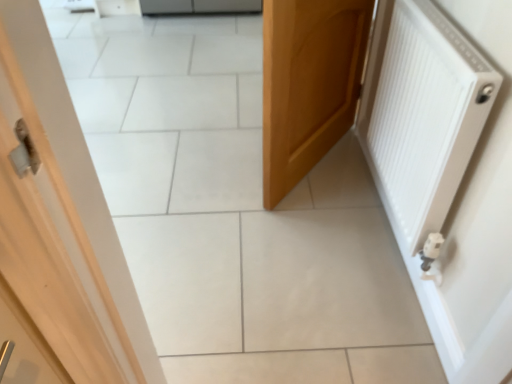
Question: From their relative heights in the image, would you say white matte radiator at right is taller or shorter than wooden door at center?

Choices:
 (A) tall
 (B) short

Answer: (B)

Question: Looking at their shapes, would you say white matte radiator at right is wider or thinner than wooden door at center?

Choices:
 (A) wide
 (B) thin

Answer: (B)

Question: From the image's perspective, is white matte radiator at right above or below wooden door at center?

Choices:
 (A) below
 (B) above

Answer: (A)

Question: From a real-world perspective, relative to white matte radiator at right, is wooden door at center vertically above or below?

Choices:
 (A) below
 (B) above

Answer: (A)

Question: Considering the positions of wooden door at center and white matte radiator at right in the image, is wooden door at center taller or shorter than white matte radiator at right?

Choices:
 (A) tall
 (B) short

Answer: (A)

Question: Would you say wooden door at center is to the left or to the right of white matte radiator at right in the picture?

Choices:
 (A) left
 (B) right

Answer: (A)

Question: Considering the positions of wooden door at center and white matte radiator at right in the image, is wooden door at center wider or thinner than white matte radiator at right?

Choices:
 (A) wide
 (B) thin

Answer: (A)